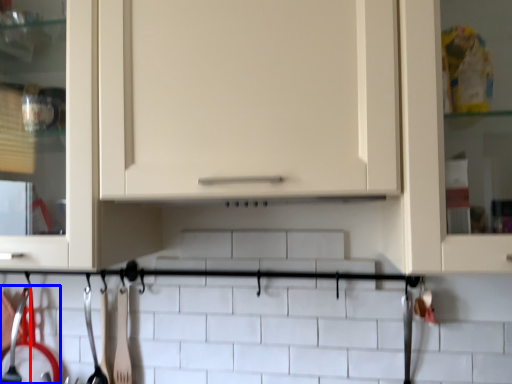
Question: Which point is closer to the camera, silverware (highlighted by a red box) or silverware (highlighted by a blue box)?

Choices:
 (A) silverware
 (B) silverware

Answer: (B)